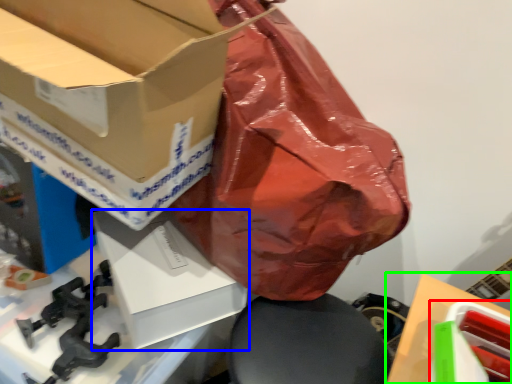
Question: Which object is the farthest from box (highlighted by a red box)? Choose among these: box (highlighted by a blue box) or cardboard box (highlighted by a green box).

Choices:
 (A) box
 (B) cardboard box

Answer: (A)